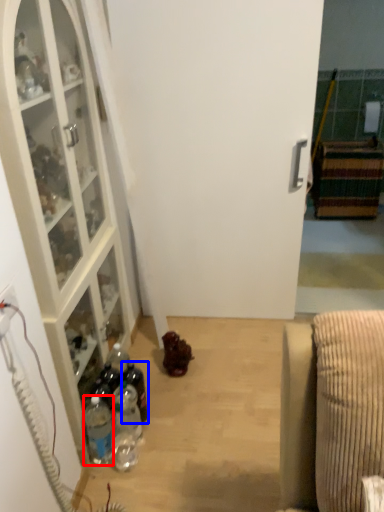
Question: Which object appears farthest to the camera in this image, bottle (highlighted by a red box) or bottle (highlighted by a blue box)?

Choices:
 (A) bottle
 (B) bottle

Answer: (B)